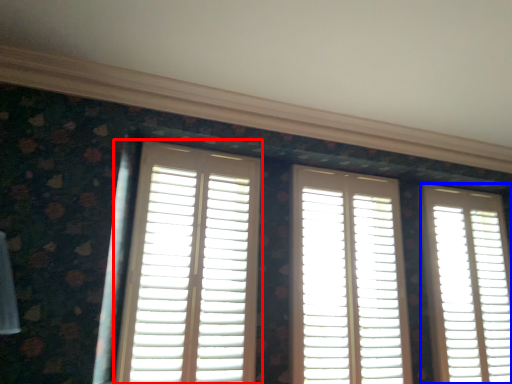
Question: Which point is closer to the camera, window (highlighted by a red box) or window (highlighted by a blue box)?

Choices:
 (A) window
 (B) window

Answer: (A)